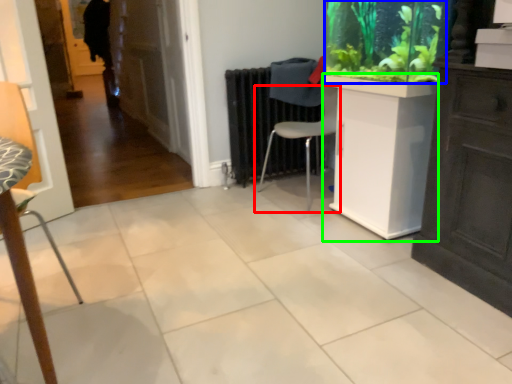
Question: Estimate the real-world distances between objects in this image. Which object is closer to chair (highlighted by a red box), plant (highlighted by a blue box) or counter (highlighted by a green box)?

Choices:
 (A) plant
 (B) counter

Answer: (B)